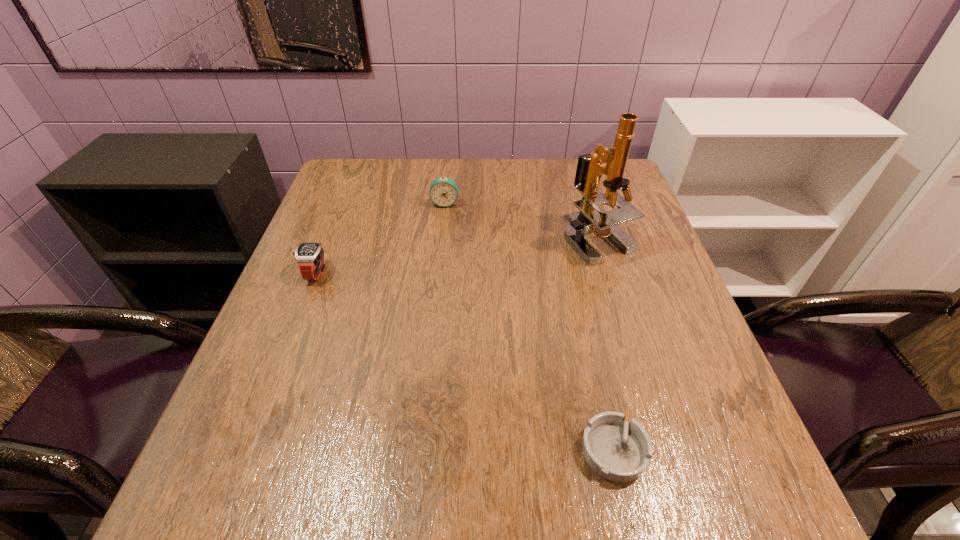
Locate an element on the screen. the tallest object is located at coordinates (590, 218).

This screenshot has height=540, width=960. Identify the location of alarm clock. (443, 192).

You are a GUI agent. You are given a task and a screenshot of the screen. Output one action in this format:
    pyautogui.click(x=<x>, y=<y>)
    Task: Click on the third object from right to left
    
    Given the screenshot: What is the action you would take?
    pyautogui.click(x=443, y=192)

Where is `the third tallest object`? The height and width of the screenshot is (540, 960). the third tallest object is located at coordinates (309, 256).

At what (x,y) coordinates should I click in order to perform the action: click on the leftmost object. Please return your answer as a coordinate pair (x, y). Looking at the image, I should click on (309, 256).

Locate an element on the screen. This screenshot has height=540, width=960. the nearest object is located at coordinates (617, 449).

Locate an element on the screen. ashtray is located at coordinates (617, 449).

Find the location of `vacant point located at the eyepiece of the tallest object`. vacant point located at the eyepiece of the tallest object is located at coordinates [651, 413].

Image resolution: width=960 pixels, height=540 pixels. Identify the location of free region located on the front-facing side of the alarm clock. (442, 236).

At what (x,y) coordinates should I click in order to perform the action: click on vacant space located 0.400m on the right of the third tallest object. Please return your answer as a coordinate pair (x, y). Looking at the image, I should click on (500, 272).